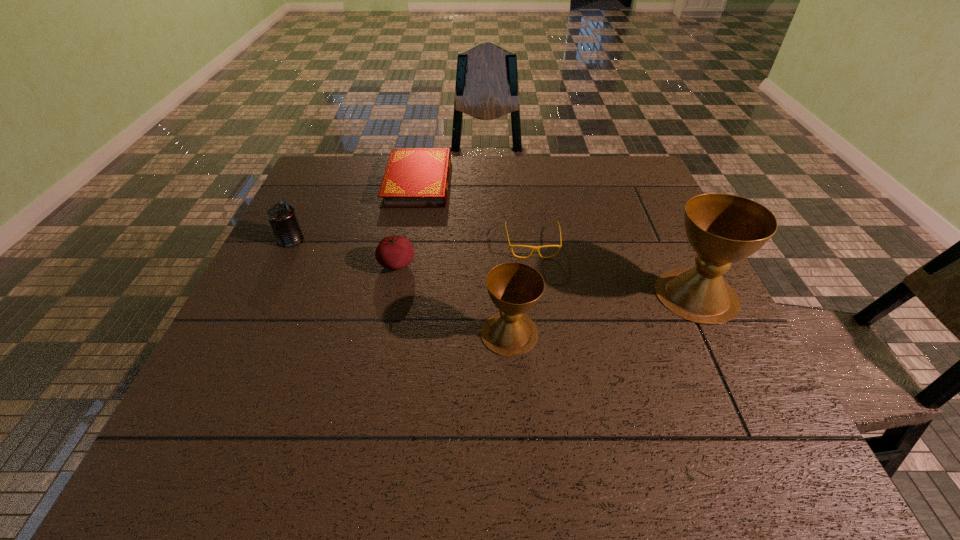
The image size is (960, 540). Identify the location of vacant space located on the front of the rightmost object. (724, 352).

Find the location of a particular element. free space located 0.110m on the cover of the farthest object is located at coordinates (409, 233).

Locate an element on the screen. Image resolution: width=960 pixels, height=540 pixels. free space located 0.050m in front of the lenses of the spectacles is located at coordinates (537, 273).

This screenshot has height=540, width=960. Identify the location of blank area located on the front of the can. (223, 380).

Image resolution: width=960 pixels, height=540 pixels. Identify the location of free space located 0.220m on the back of the fourth tallest object. (409, 202).

Locate an element on the screen. This screenshot has height=540, width=960. object present at the far edge is located at coordinates tap(414, 177).

This screenshot has width=960, height=540. What are the coordinates of `object that is positioned at the left edge` in the screenshot? It's located at (282, 217).

Identify the location of object that is at the right edge. Image resolution: width=960 pixels, height=540 pixels. (722, 228).

At what (x,y) coordinates should I click in order to perform the action: click on free location at the far edge of the desktop. Please return your answer as a coordinate pair (x, y). The height and width of the screenshot is (540, 960). Looking at the image, I should click on (597, 184).

What are the coordinates of `vacant space at the left edge of the desktop` in the screenshot? It's located at (298, 335).